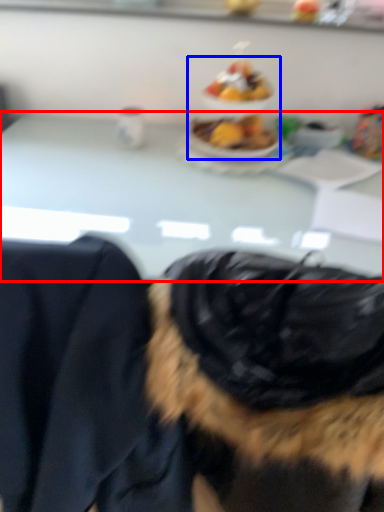
Question: Which point is further to the camera, table (highlighted by a red box) or food (highlighted by a blue box)?

Choices:
 (A) table
 (B) food

Answer: (B)